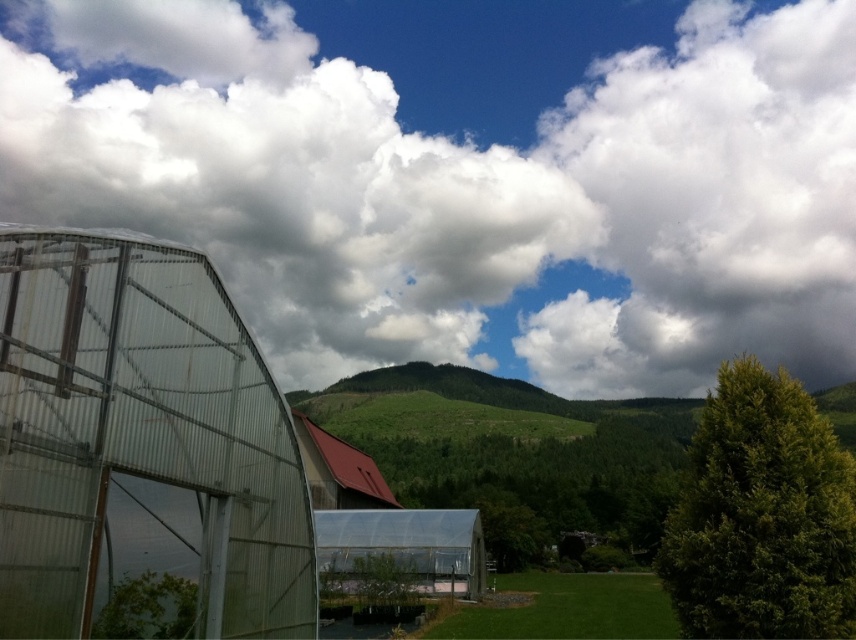
How distant is white fluffy cloud at upper center from transparent plastic greenhouse at left?

white fluffy cloud at upper center and transparent plastic greenhouse at left are 183.35 meters apart from each other.

Does point (714, 296) lie in front of point (199, 346)?

No, it is not.

Locate an element on the screen. Image resolution: width=856 pixels, height=640 pixels. white fluffy cloud at upper center is located at coordinates (467, 176).

How far apart are white fluffy cloud at upper center and green textured tree at right?

The distance of white fluffy cloud at upper center from green textured tree at right is 213.71 meters.

Does white fluffy cloud at upper center have a lesser width compared to green textured tree at right?

No, white fluffy cloud at upper center is not thinner than green textured tree at right.

Where is `white fluffy cloud at upper center`? The width and height of the screenshot is (856, 640). white fluffy cloud at upper center is located at coordinates (467, 176).

The width and height of the screenshot is (856, 640). In order to click on transparent plastic greenhouse at left in this screenshot , I will do `click(141, 449)`.

Is point (183, 284) positioned before point (718, 532)?

Yes, point (183, 284) is closer to viewer.

You are a GUI agent. You are given a task and a screenshot of the screen. Output one action in this format:
    pyautogui.click(x=<x>, y=<y>)
    Task: Click on the transparent plastic greenhouse at left
    
    Given the screenshot: What is the action you would take?
    pyautogui.click(x=141, y=449)